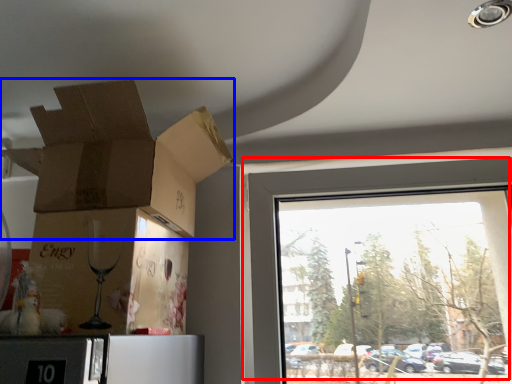
Question: Which point is closer to the camera, window (highlighted by a red box) or cardboard box (highlighted by a blue box)?

Choices:
 (A) window
 (B) cardboard box

Answer: (B)